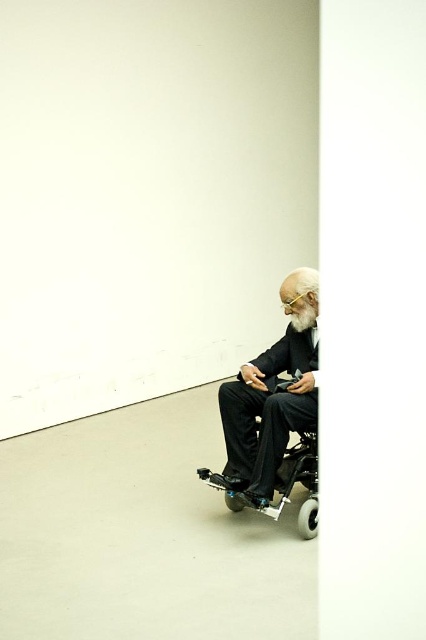
Does black matte wheelchair at right lie behind black plastic wheelchair at lower right?

No.

The height and width of the screenshot is (640, 426). I want to click on black matte wheelchair at right, so click(x=271, y=396).